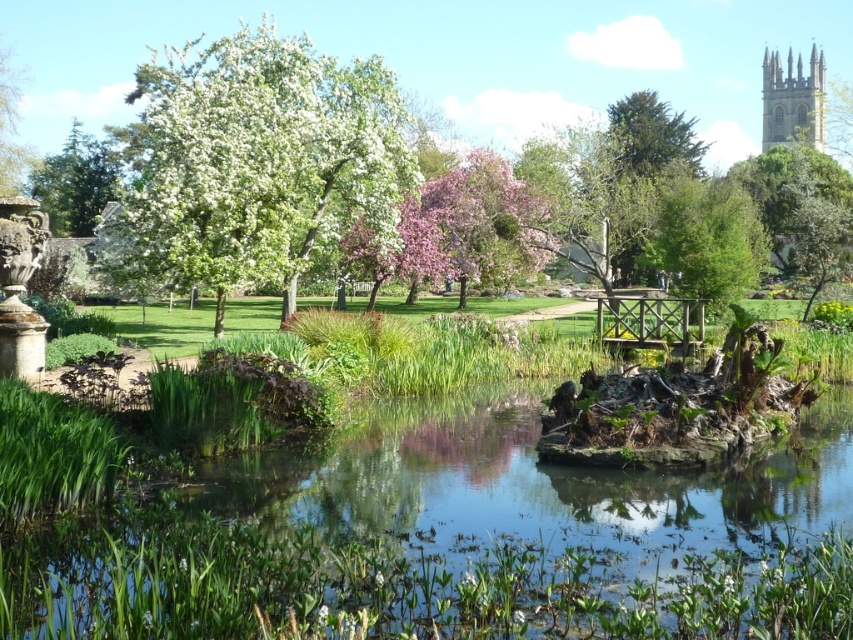
The height and width of the screenshot is (640, 853). Describe the element at coordinates (392, 584) in the screenshot. I see `clear water at center` at that location.

Does point (670, 612) come closer to viewer compared to point (85, 189)?

Yes, point (670, 612) is closer to viewer.

The width and height of the screenshot is (853, 640). What are the coordinates of `clear water at center` in the screenshot? It's located at (392, 584).

Is clear water at center thinner than white blossoming tree at upper left?

Indeed, clear water at center has a lesser width compared to white blossoming tree at upper left.

Can you confirm if clear water at center is smaller than white blossoming tree at upper left?

Yes.

Find the location of a particular element. clear water at center is located at coordinates (392, 584).

You are a GUI agent. You are given a task and a screenshot of the screen. Output one action in this format:
    pyautogui.click(x=<x>, y=<y>)
    Task: Click on the white blossoming tree at upper left
    The image size is (853, 640).
    Given the screenshot: What is the action you would take?
    pyautogui.click(x=256, y=163)

Looking at this image, which is more to the right, white blossoming tree at upper left or stone tower at upper right?

stone tower at upper right

Find the location of a particular element. white blossoming tree at upper left is located at coordinates (256, 163).